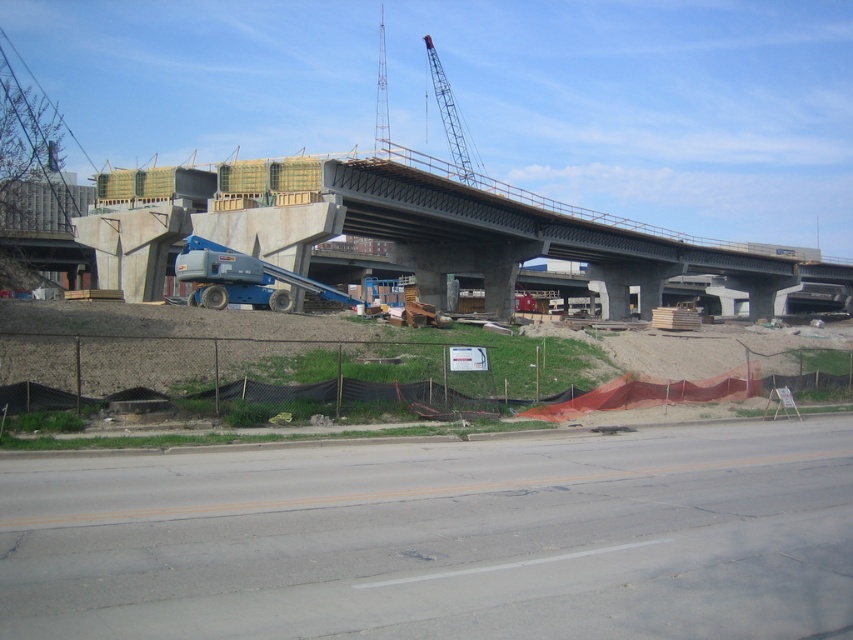
Question: Is gray asphalt highway at lower center bigger than metallic gray crane at upper center?

Choices:
 (A) no
 (B) yes

Answer: (A)

Question: Which of the following is the closest to the observer?

Choices:
 (A) (735, 257)
 (B) (62, 563)

Answer: (B)

Question: Considering the real-world distances, which object is farthest from the gray asphalt highway at lower center?

Choices:
 (A) metallic gray crane at upper center
 (B) concrete at center

Answer: (A)

Question: From the image, what is the correct spatial relationship of gray asphalt highway at lower center in relation to metallic gray crane at upper center?

Choices:
 (A) above
 (B) below

Answer: (B)

Question: Estimate the real-world distances between objects in this image. Which object is farther from the metallic gray crane at upper center?

Choices:
 (A) concrete at center
 (B) gray asphalt highway at lower center

Answer: (B)

Question: Can you confirm if gray asphalt highway at lower center is positioned below concrete at center?

Choices:
 (A) yes
 (B) no

Answer: (A)